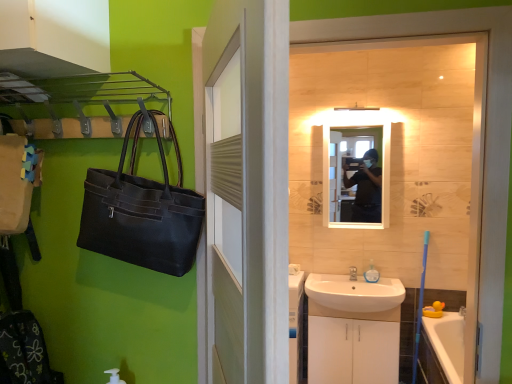
Question: Considering the positions of white glossy cabinet at lower center and silver metallic faucet at sink right in the image, is white glossy cabinet at lower center wider or thinner than silver metallic faucet at sink right?

Choices:
 (A) thin
 (B) wide

Answer: (B)

Question: From a real-world perspective, is white glossy cabinet at lower center physically located above or below silver metallic faucet at sink right?

Choices:
 (A) above
 (B) below

Answer: (B)

Question: Which is farther from the white ceramic sink at lower center?

Choices:
 (A) translucent plastic soap dispenser at sink
 (B) white wood door at center
 (C) silver metallic faucet at sink right
 (D) white glossy cabinet at lower center
 (E) matte black mirror at center

Answer: (B)

Question: Which object is the closest to the silver metallic faucet at sink right?

Choices:
 (A) white ceramic sink at lower center
 (B) white glossy cabinet at lower center
 (C) matte black mirror at center
 (D) white wood door at center
 (E) translucent plastic soap dispenser at sink

Answer: (E)